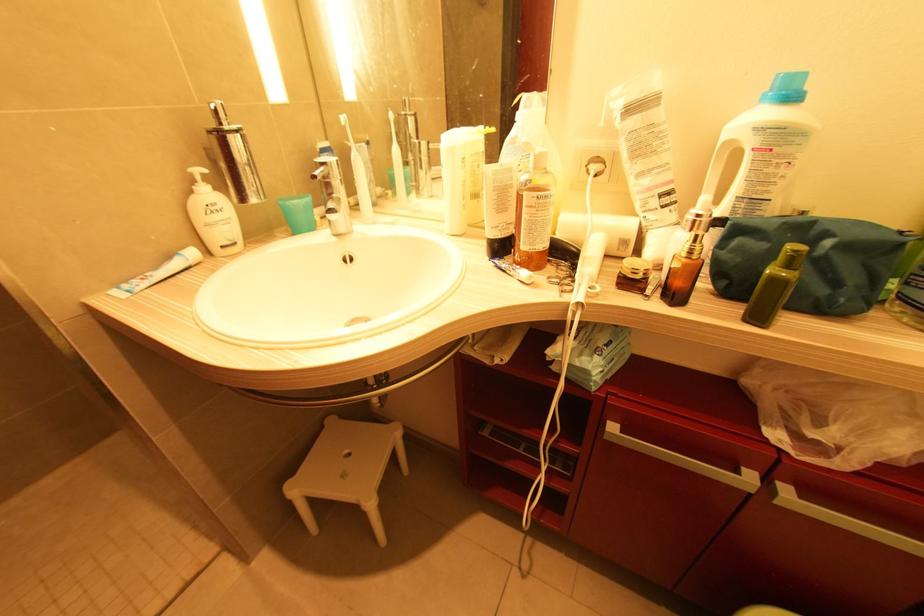
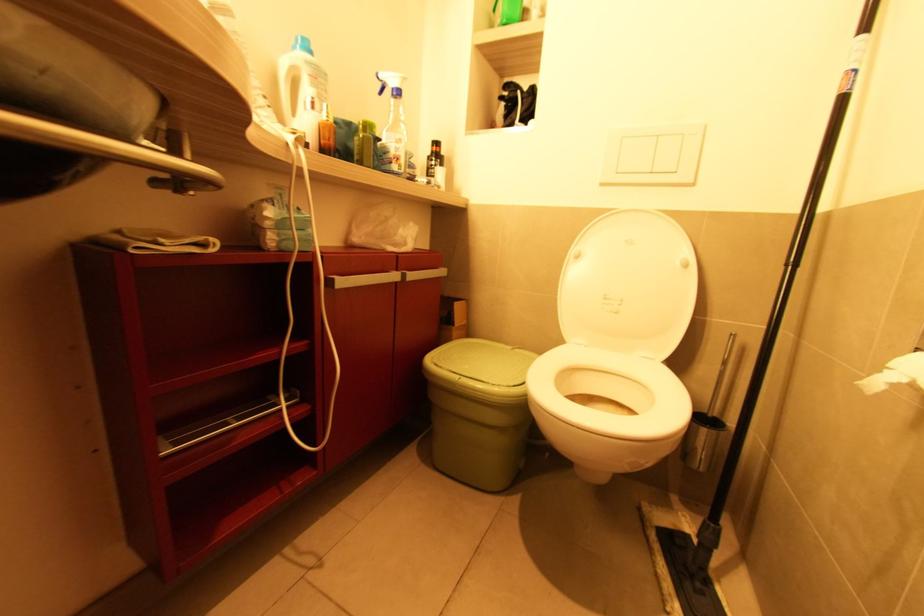
Question: The images are taken continuously from a first-person perspective. In which direction is your viewpoint rotating?

Choices:
 (A) Left
 (B) Right
 (C) Up
 (D) Down

Answer: (B)